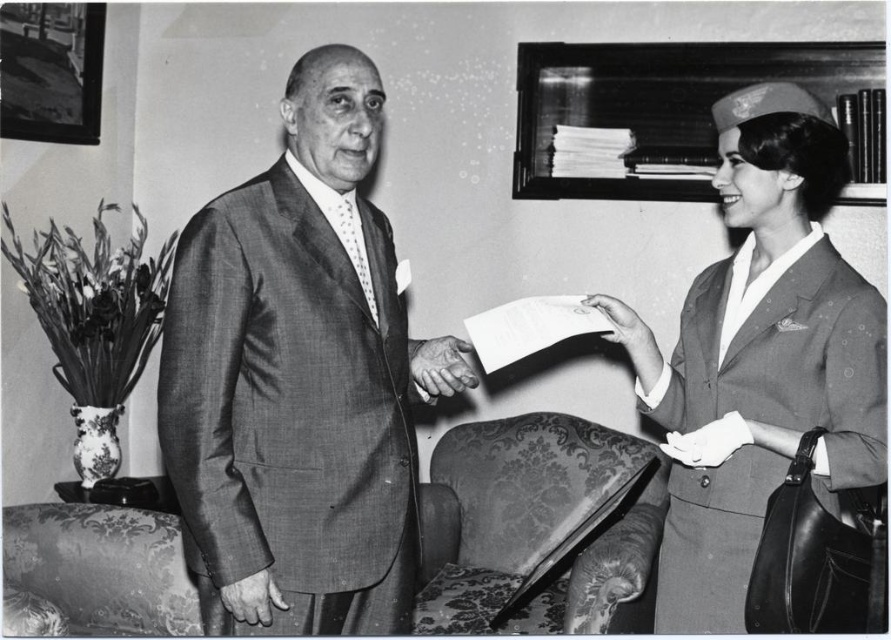
Question: From the image, what is the correct spatial relationship of smooth skin hand at center in relation to white leather gloves at center?

Choices:
 (A) below
 (B) above

Answer: (B)

Question: Which of these objects is positioned farthest from the damask-patterned fabric armchair at lower center?

Choices:
 (A) smooth skin hand at center
 (B) smooth wool suit at center

Answer: (B)

Question: Does damask-patterned fabric armchair at lower center have a larger size compared to smooth skin hand at center?

Choices:
 (A) no
 (B) yes

Answer: (B)

Question: Which of these objects is positioned closest to the smooth fabric uniform at right?

Choices:
 (A) white leather gloves at center
 (B) smooth wool suit at center

Answer: (A)

Question: Which of the following is the farthest from the observer?

Choices:
 (A) smooth fabric uniform at right
 (B) smooth skin hand at center
 (C) white leather gloves at center

Answer: (B)

Question: Where is smooth fabric uniform at right located in relation to white leather gloves at center in the image?

Choices:
 (A) above
 (B) below

Answer: (A)